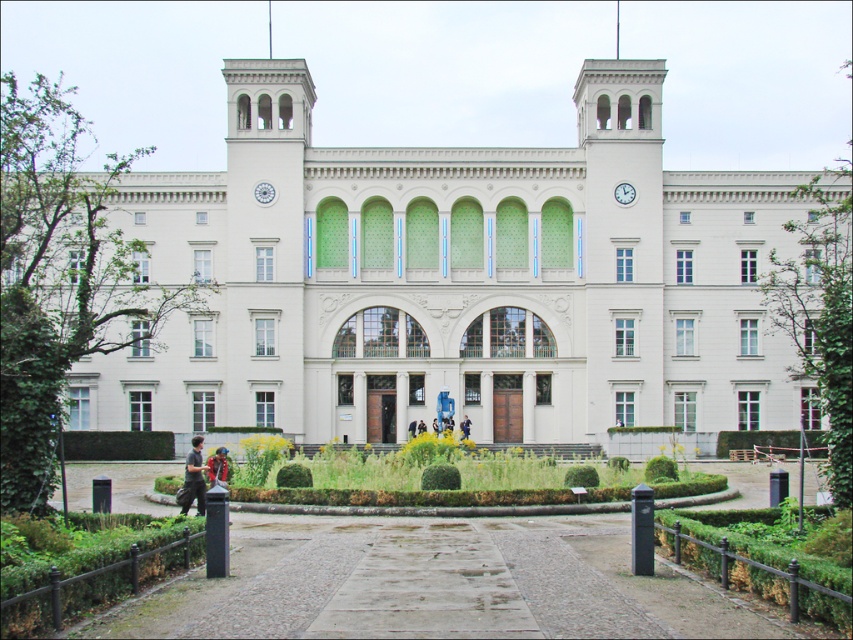
You are standing in front of the grand building and notice the green grass at center and the dark gray fabric jacket at lower left. Which object is closer to the ground?

The green grass at center is closer to the ground because it is below the dark gray fabric jacket at lower left.

You are a delivery person standing at the entrance of the grand building. You need to place a package on the multicolored fabric at lower center but there is a dark gray fabric jacket at lower left in the way. Can you move the jacket to make space?

The dark gray fabric jacket at lower left and multicolored fabric at lower center are 2.32 meters apart from each other. Since the distance between them is over 2 meters, the jacket is not blocking the path to the multicolored fabric at lower center. Therefore, you don not need to move the jacket.